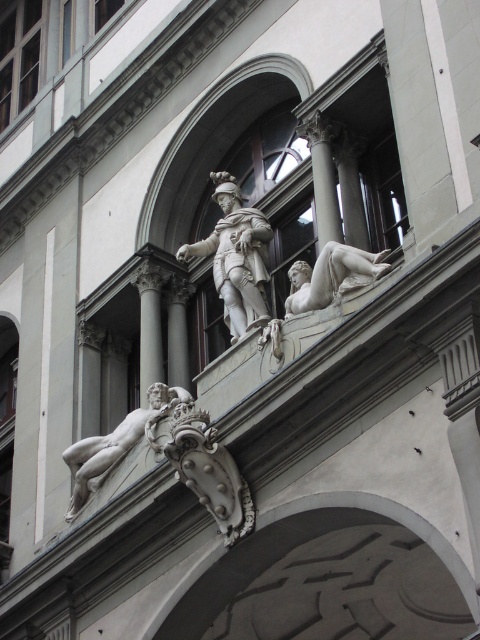
You are an art student standing in front of the classical building and want to sketch the statues. Which statue, the white marble nude at lower left or the white marble reclining figure at right, is closer to you?

The white marble nude at lower left is closer to you because it is further to the viewer than the white marble reclining figure at right.